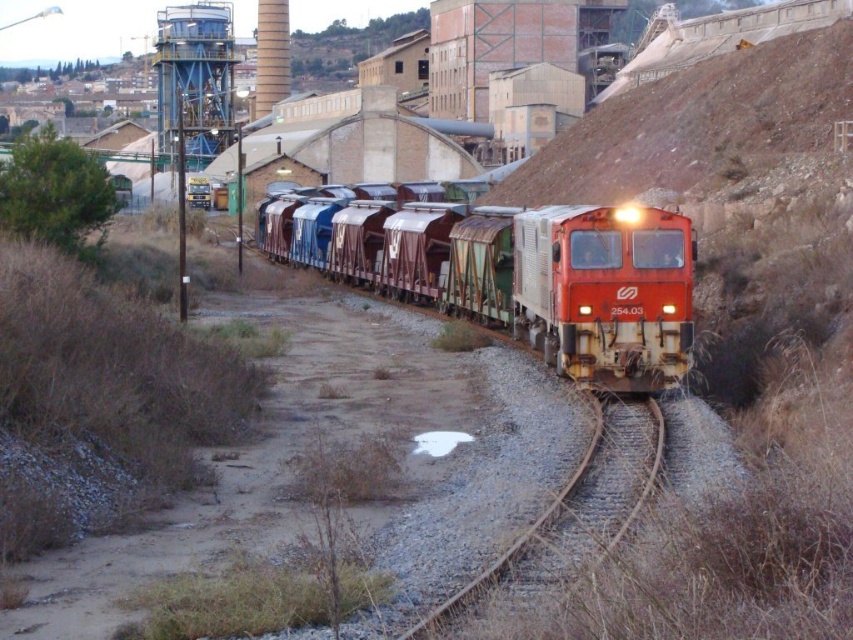
Is rusty metal train at center taller than rusty metal train track at lower right?

Yes, rusty metal train at center is taller than rusty metal train track at lower right.

Locate an element on the screen. The image size is (853, 640). rusty metal train at center is located at coordinates (517, 273).